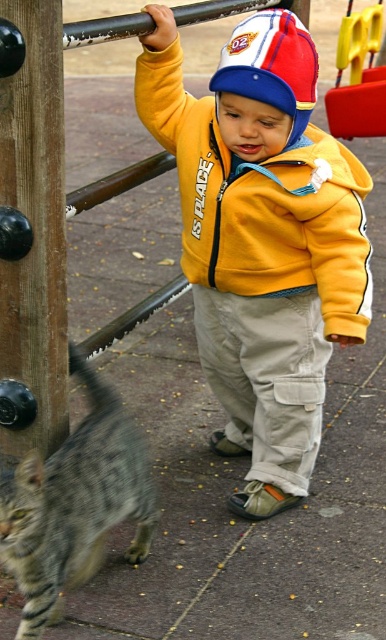
Question: From the image, what is the correct spatial relationship of yellow fleece jacket at center in relation to brown wooden pole at left?

Choices:
 (A) above
 (B) below

Answer: (B)

Question: Among these objects, which one is nearest to the camera?

Choices:
 (A) yellow fleece jacket at center
 (B) gray striped fur at lower left
 (C) brown wooden pole at left

Answer: (B)

Question: Which object is positioned farthest from the gray striped fur at lower left?

Choices:
 (A) brown wooden pole at left
 (B) yellow fleece jacket at center

Answer: (B)

Question: Among these objects, which one is nearest to the camera?

Choices:
 (A) yellow fleece jacket at center
 (B) gray striped fur at lower left

Answer: (B)

Question: Does yellow fleece jacket at center appear on the left side of gray striped fur at lower left?

Choices:
 (A) no
 (B) yes

Answer: (A)

Question: Does yellow fleece jacket at center appear on the right side of gray striped fur at lower left?

Choices:
 (A) yes
 (B) no

Answer: (A)